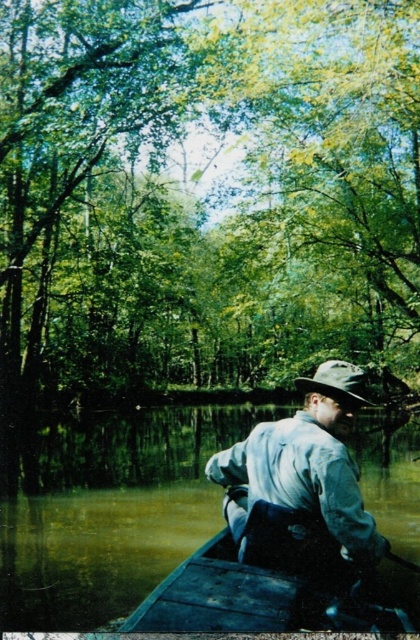
You are standing on the shore of the lake and want to reach the point marked as point (304,625) in the boat. If your maximum comfortable walking distance in water is 2 meters, can you safely walk to that point from the shore?

The distance of point (304,625) from viewer is 2.96 meters, which exceeds your maximum comfortable walking distance of 2 meters. Therefore, you cannot safely walk to that point from the shore.

You are standing on the dock and want to place a 6 feet long fishing rod between the dark brown wooden canoe at lower center and the brown fabric hat at center. Is there enough space between them to fit the rod?

The dark brown wooden canoe at lower center and the brown fabric hat at center are 5.63 feet apart from each other. Since the fishing rod is 6 feet long, which is longer than the distance between them, there is not enough space to fit the rod between them.

You are standing on the dock and want to board the boat. Which object should you approach first, the dark brown wooden canoe at lower center or the light blue denim shirt at center?

You should approach the dark brown wooden canoe at lower center first because it is positioned on the left side of the light blue denim shirt at center, meaning the canoe is closer to the dock where you are standing.